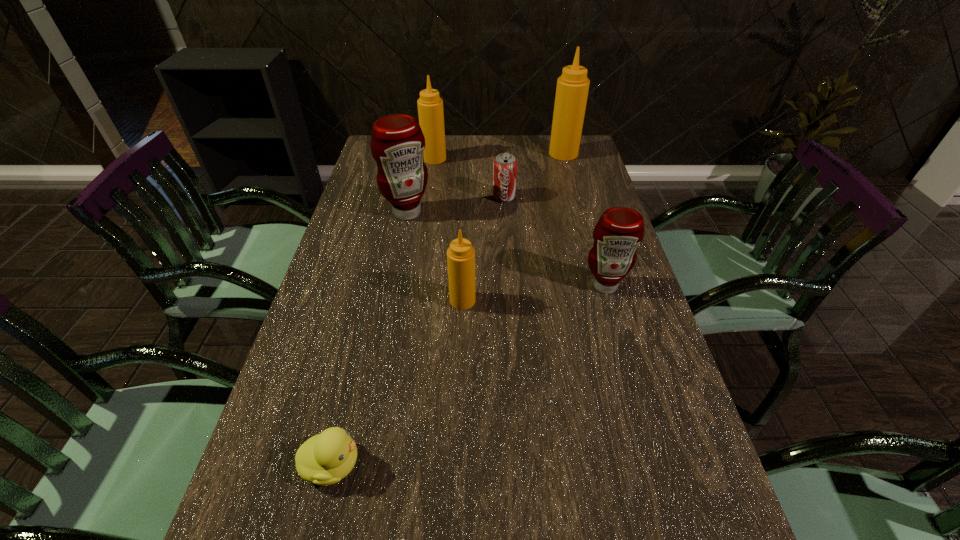
This screenshot has width=960, height=540. What are the coordinates of `vacant space that satisfies the following two spatial constraints: 1. on the front side of the leftmost tan condiment; 2. on the left side of the smaller red condiment` in the screenshot? It's located at (416, 285).

You are a GUI agent. You are given a task and a screenshot of the screen. Output one action in this format:
    pyautogui.click(x=<x>, y=<y>)
    Task: Click on the vacant space that satisfies the following two spatial constraints: 1. on the front side of the leftmost tan condiment; 2. at the beak of the shortest object
    
    Given the screenshot: What is the action you would take?
    pyautogui.click(x=390, y=464)